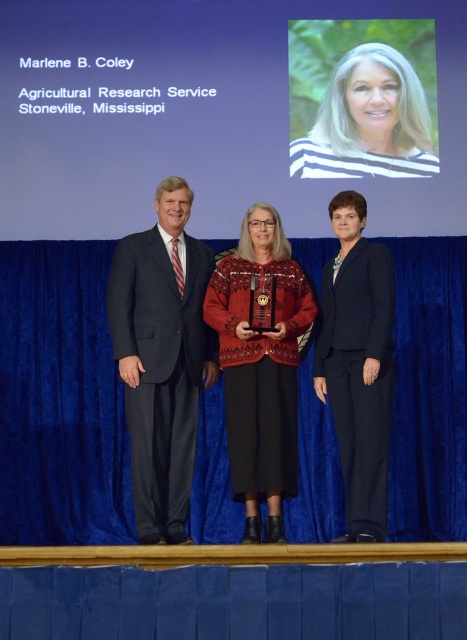
You are attending an award ceremony and notice two items on the stage. The blue fabric curtain at center and the knitted sweater at center. Which one is positioned to the left?

The blue fabric curtain at center is to the left of knitted sweater at center, so the blue fabric curtain at center is positioned to the left.

You are standing at the center of the stage where the woman with the trophy is standing. You want to walk to the point labeled point (120, 250). Which direction should you move relative to the point labeled point (247, 396)?

Since point (120, 250) is behind point (247, 396), you should move in the direction away from point (247, 396) to reach point (120, 250).